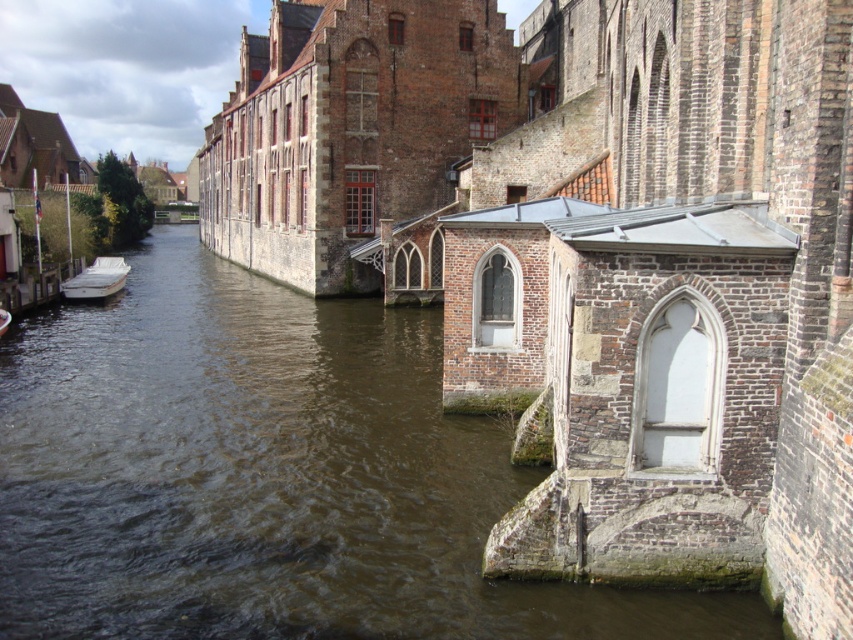
Question: Which of the following is the closest to the observer?

Choices:
 (A) white glossy boat at left
 (B) brown water at center

Answer: (B)

Question: Among these points, which one is farthest from the camera?

Choices:
 (A) (93, 289)
 (B) (6, 320)

Answer: (A)

Question: Which object is closer to the camera taking this photo?

Choices:
 (A) white matte boat at left
 (B) white glossy boat at left
 (C) brown water at center

Answer: (C)

Question: Can you confirm if white matte boat at left is positioned to the right of white glossy boat at left?

Choices:
 (A) yes
 (B) no

Answer: (B)

Question: Does white matte boat at left have a lesser width compared to white glossy boat at left?

Choices:
 (A) no
 (B) yes

Answer: (A)

Question: Does brown water at center appear on the right side of white matte boat at left?

Choices:
 (A) yes
 (B) no

Answer: (A)